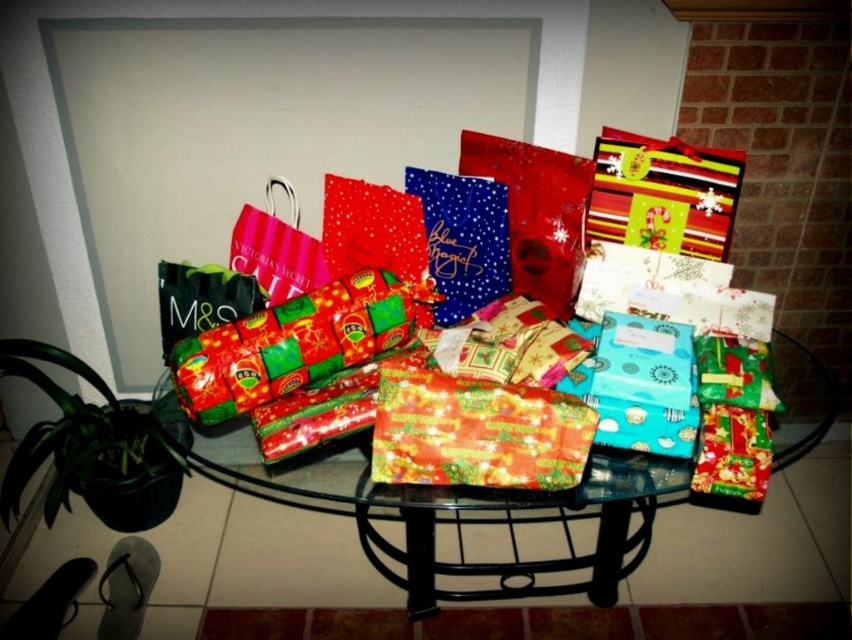
You are standing in front of the table and want to pick up an item from the translucent glass table at center. Considering your height is 5 feet 6 inches, will you need to bend down to reach it?

The translucent glass table at center is 3.83 feet from camera. Since the average table height is around 30 inches, and you are 5 feet 6 inches tall, you would need to bend down slightly to reach the items on the translucent glass table at center.

You are arranging gifts on the translucent glass table at center and the shiny red wrapping paper at center. According to the scene, which object is positioned to the right?

The translucent glass table at center is to the right of the shiny red wrapping paper at center, so the translucent glass table at center is positioned to the right.

You are standing at the edge of the glass table and want to place a new gift at the point marked by coordinates point [496,520]. Is this point on the glass table?

Yes, the point [496,520] is on the translucent glass table at center, so placing the gift there would be possible.